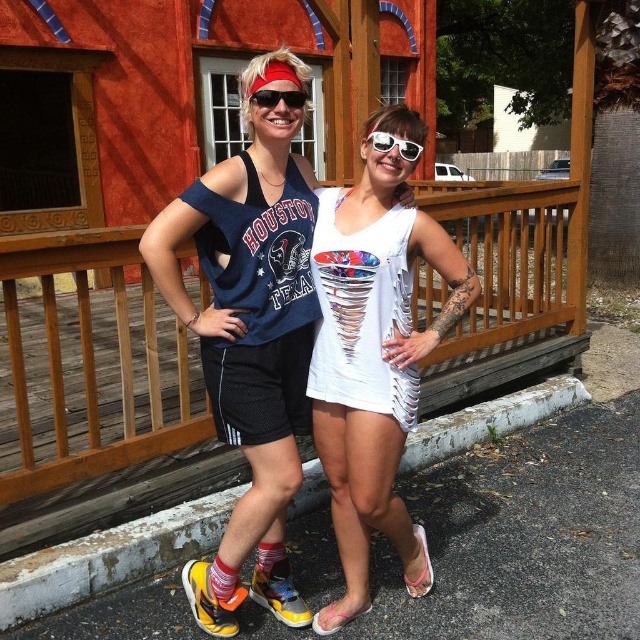
You are a photographer who wants to take a picture of the two people in the scene. You have a camera and a pair of white reflective sunglasses at center. If you want to put the sunglasses on the camera to protect it from the sun, will they fit? The camera is 0.3 meters wide.

The white reflective sunglasses at center and camera are 2.14 meters apart. Since the distance between them is greater than the camera width, the sunglasses cannot be placed on the camera to protect it from the sun.

You are trying to decide whether to place a new decorative item on the wooden rail at center or the white reflective sunglasses at center. Based on their sizes, which one would be more suitable for a larger item?

The wooden rail at center is bigger than the white reflective sunglasses at center, so it can accommodate a larger decorative item.